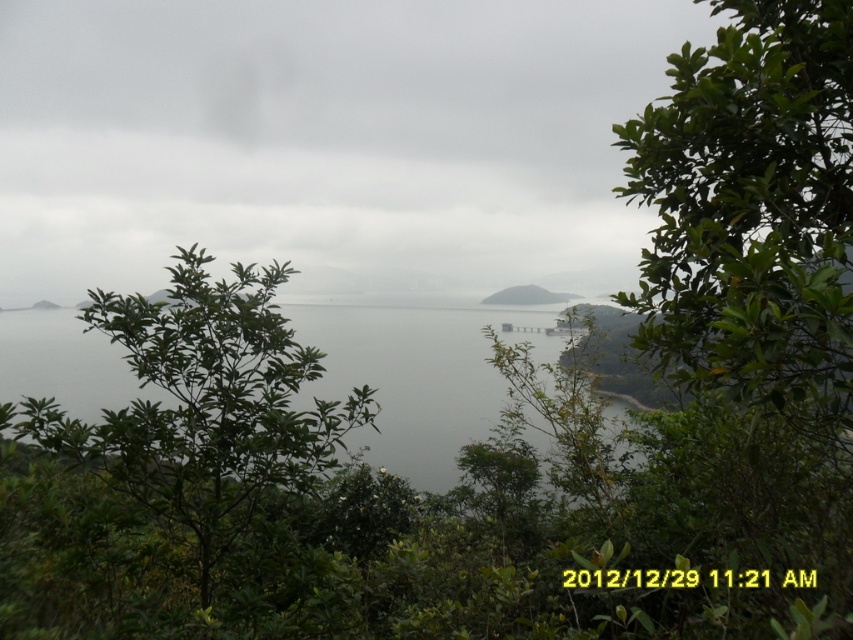
You are standing at the elevated viewpoint overlooking the coastal landscape. You notice the green leafy tree at right and the gray water at center. Which object appears taller in the scene?

The green leafy tree at right is taller than the gray water at center.